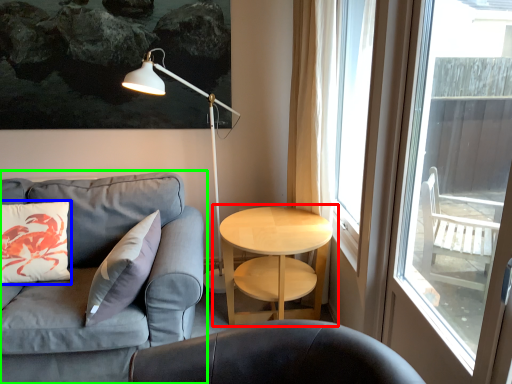
Question: Considering the real-world distances, which object is closest to table (highlighted by a red box)? pillow (highlighted by a blue box) or studio couch (highlighted by a green box).

Choices:
 (A) pillow
 (B) studio couch

Answer: (B)